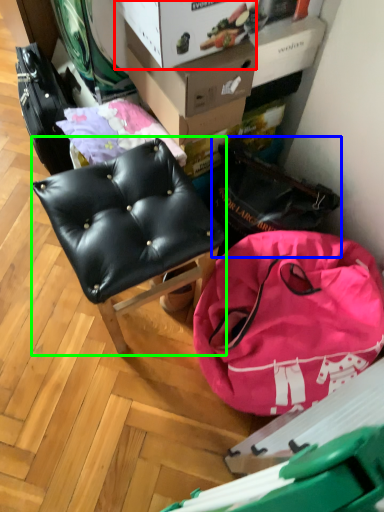
Question: Estimate the real-world distances between objects in this image. Which object is farther from cardboard box (highlighted by a red box), messenger bag (highlighted by a blue box) or chair (highlighted by a green box)?

Choices:
 (A) messenger bag
 (B) chair

Answer: (A)